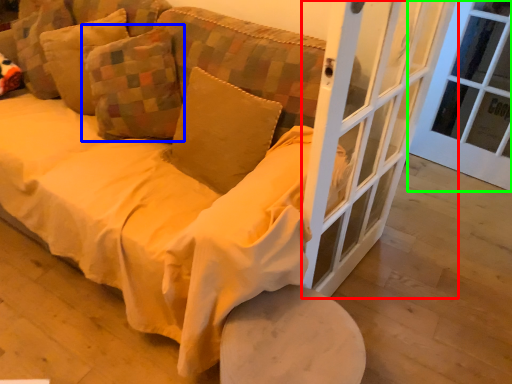
Question: Which object is positioned farthest from screen door (highlighted by a red box)? Select from pillow (highlighted by a blue box) and window frame (highlighted by a green box).

Choices:
 (A) pillow
 (B) window frame

Answer: (B)